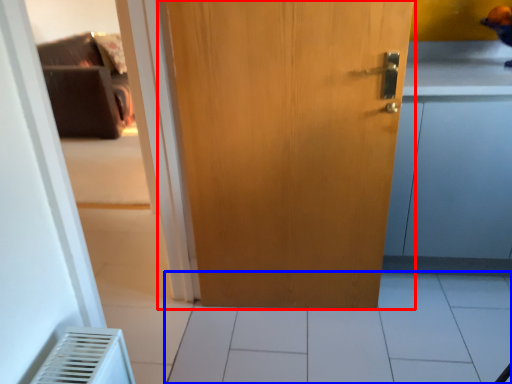
Question: Which of the following is the farthest to the observer, door (highlighted by a red box) or tile (highlighted by a blue box)?

Choices:
 (A) door
 (B) tile

Answer: (B)